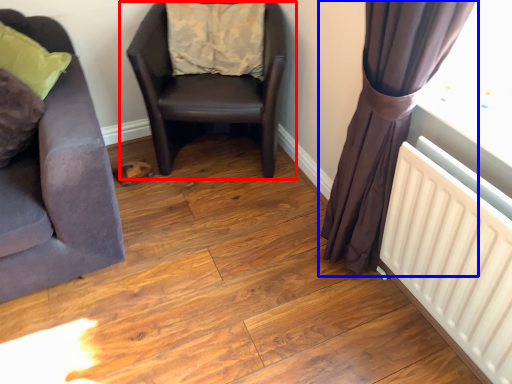
Question: Among these objects, which one is nearest to the camera, chair (highlighted by a red box) or curtain (highlighted by a blue box)?

Choices:
 (A) chair
 (B) curtain

Answer: (B)